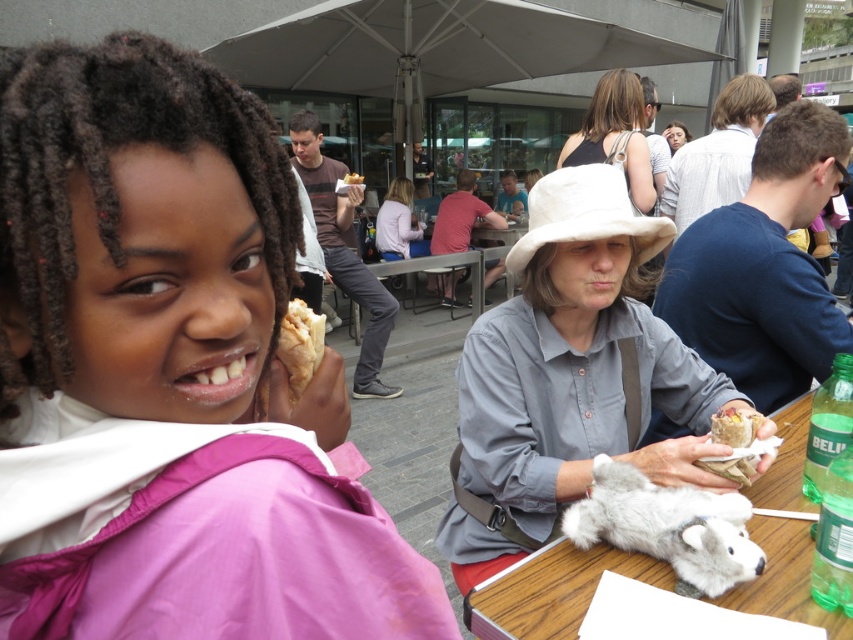
Does wooden table at center have a lesser height compared to fuzzy white stuffed animal at center?

No.

Can you confirm if wooden table at center is positioned above fuzzy white stuffed animal at center?

No.

The width and height of the screenshot is (853, 640). I want to click on wooden table at center, so click(552, 592).

Does point (762, 545) come in front of point (345, 179)?

Yes, it is in front of point (345, 179).

Is the position of wooden table at center more distant than that of bread-like at center?

No, it is not.

Image resolution: width=853 pixels, height=640 pixels. In order to click on wooden table at center in this screenshot , I will do `click(552, 592)`.

Is matte brown sandwich at lower right closer to the viewer compared to bread-like at center?

Yes.

Which of these two, matte brown sandwich at lower right or bread-like at center, stands shorter?

Standing shorter between the two is matte brown sandwich at lower right.

Does point (743, 433) come in front of point (360, 182)?

That is True.

I want to click on matte brown sandwich at lower right, so click(735, 426).